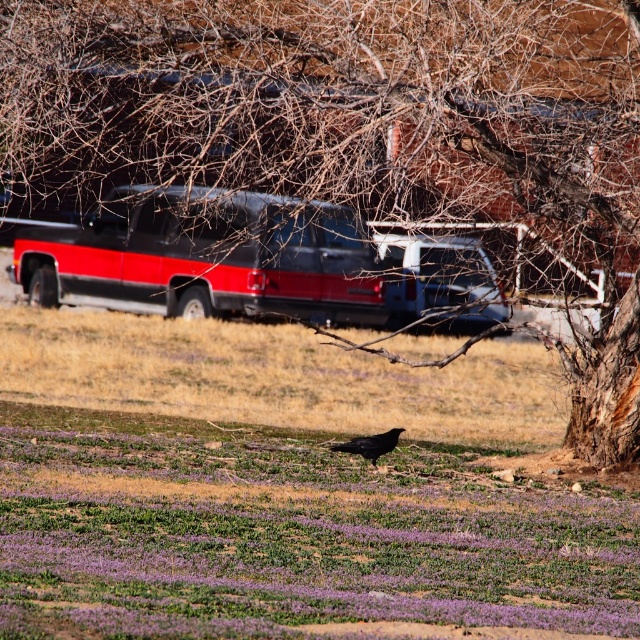
You are standing in the outdoor scene and want to place a small flag at each of the two points labeled point (77, 12) and point (304, 252). Which point will have its flag closer to your eyes?

Point (77, 12) is closer to the camera than point (304, 252), so the flag placed at point (77, 12) will be closer to your eyes.

You are a photographer trying to capture both the black matte bird at center and the shiny black bird at center in a single shot. Which bird will appear closer to the camera in the photo?

The black matte bird at center will appear closer to the camera because it is positioned in front of the shiny black bird at center.

You are a photographer standing at the camera position. You want to capture a closeup shot of the black matte bird at center. Based on the scene description, can you estimate whether you need to move closer or farther away to achieve this?

The black matte bird at center is 9.18 meters from the camera. To capture a closeup shot, you would need to move closer to the bird since it is currently 9.18 meters away, which is too far for a closeup.